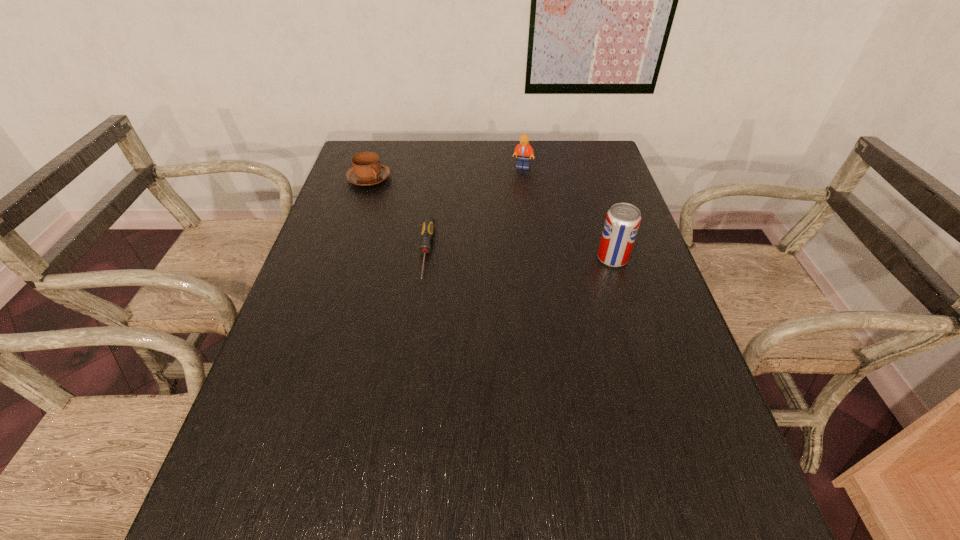
Image resolution: width=960 pixels, height=540 pixels. Identify the location of vacant region located on the front-facing side of the second object from right to left. (542, 245).

This screenshot has height=540, width=960. I want to click on vacant space located on the front-facing side of the second object from right to left, so click(x=537, y=222).

Identify the location of free space located 0.090m on the front-facing side of the second object from right to left. The image size is (960, 540). tap(528, 185).

You are a GUI agent. You are given a task and a screenshot of the screen. Output one action in this format:
    pyautogui.click(x=<x>, y=<y>)
    Task: Click on the free region located on the side of the third tallest object with the handle
    The image size is (960, 540).
    Given the screenshot: What is the action you would take?
    pyautogui.click(x=434, y=210)

Where is `vacant space situated on the side of the third tallest object with the handle`? vacant space situated on the side of the third tallest object with the handle is located at coordinates (486, 234).

Where is `free space located 0.320m on the side of the third tallest object with the handle`? Image resolution: width=960 pixels, height=540 pixels. free space located 0.320m on the side of the third tallest object with the handle is located at coordinates (463, 223).

Locate an element on the screen. Lego at the far edge is located at coordinates (523, 150).

This screenshot has width=960, height=540. Identify the location of cappuccino that is at the far edge. (366, 170).

The height and width of the screenshot is (540, 960). I want to click on object that is at the left edge, so click(x=366, y=170).

The image size is (960, 540). In order to click on object that is at the right edge in this screenshot , I will do `click(622, 222)`.